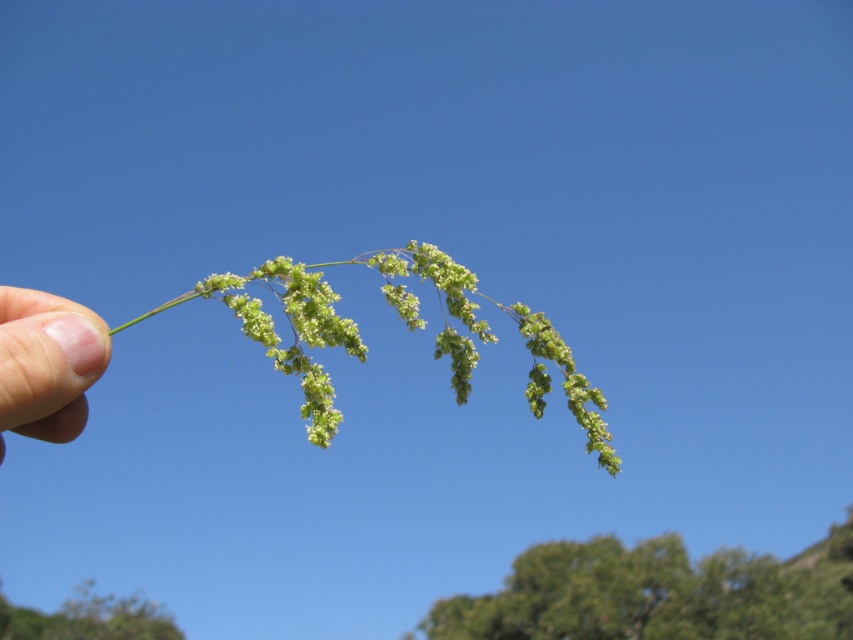
You are a landscape designer planning to place the green leafy tree at lower right and the green fuzzy plant at lower left in a garden. Based on their sizes, which one should be placed closer to the garden entrance to ensure both fit well without overcrowding?

The green leafy tree at lower right might be wider than the green fuzzy plant at lower left, so it should be placed further back to accommodate its width, allowing the green fuzzy plant at lower left to be closer to the entrance without overcrowding.

You are a gardener trying to identify which part of the plant is the main stem. Looking at the green fuzzy plant at center and the pink flesh at lower left, which one is bigger in size?

The green fuzzy plant at center is larger in size than the pink flesh at lower left.

You are a botanist examining a plant in a sunny environment. You notice a point marked at coordinates (405, 326). What does this point indicate?

The point at (405, 326) marks the location of the green fuzzy plant at center.